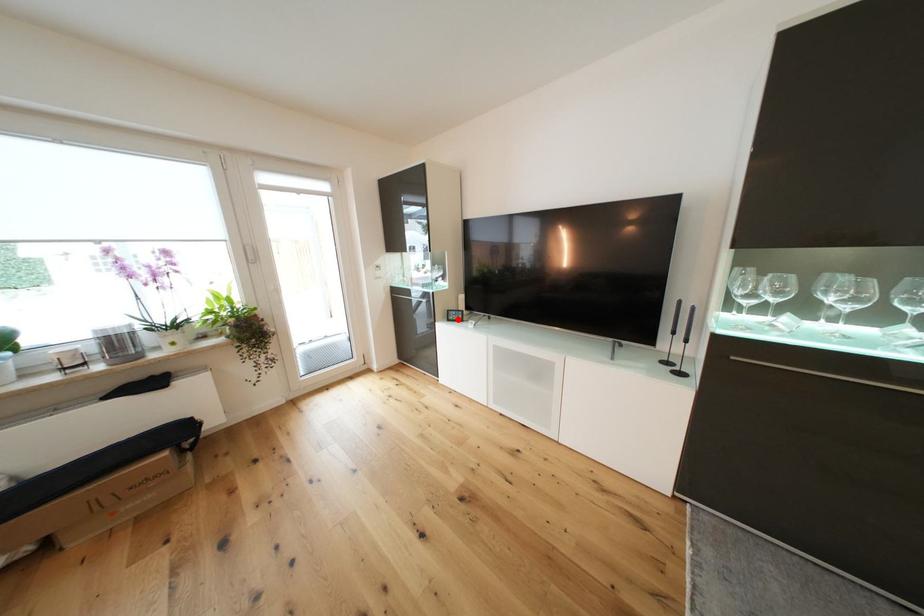
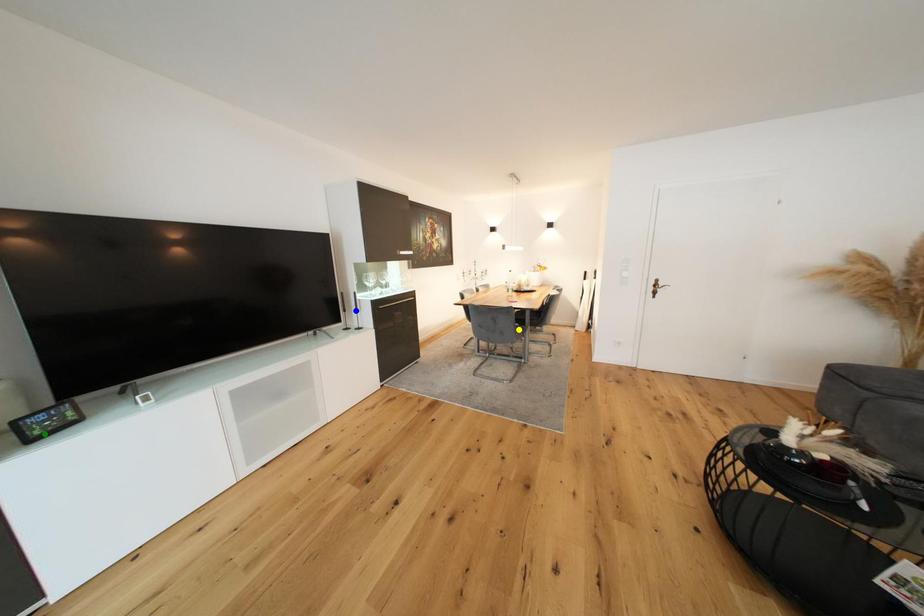
Question: I am providing you with two images of the same scene from different viewpoints. A red point is marked on the first image. You are given multiple points on the second image. Which mark in image 2 goes with the point in image 1?

Choices:
 (A) yellow point
 (B) blue point
 (C) green point

Answer: (C)